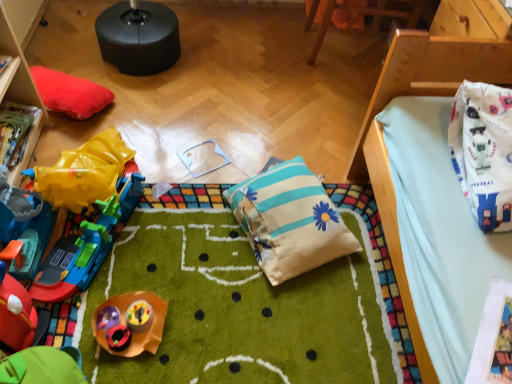
Question: Considering the relative sizes of white fabric bag at upper right and plastic toy at center, arranged as the first toy when ordered from the bottom, in the image provided, is white fabric bag at upper right bigger than plastic toy at center, arranged as the first toy when ordered from the bottom,?

Choices:
 (A) yes
 (B) no

Answer: (A)

Question: Considering the relative sizes of white fabric bag at upper right and plastic toy at center, marked as the 3th toy in a top-to-bottom arrangement, in the image provided, is white fabric bag at upper right shorter than plastic toy at center, marked as the 3th toy in a top-to-bottom arrangement,?

Choices:
 (A) yes
 (B) no

Answer: (B)

Question: Is plastic toy at center, marked as the 3th toy in a top-to-bottom arrangement, inside white fabric bag at upper right?

Choices:
 (A) no
 (B) yes

Answer: (A)

Question: Would you consider white fabric bag at upper right to be distant from plastic toy at center, arranged as the first toy when ordered from the bottom?

Choices:
 (A) no
 (B) yes

Answer: (B)

Question: From a real-world perspective, does white fabric bag at upper right sit lower than plastic toy at center, arranged as the first toy when ordered from the bottom?

Choices:
 (A) no
 (B) yes

Answer: (A)

Question: Is white fabric bag at upper right looking in the opposite direction of plastic toy at center, arranged as the first toy when ordered from the bottom?

Choices:
 (A) yes
 (B) no

Answer: (B)

Question: Is wooden toy train at left, which appears as the 1th furniture when viewed from the left, wider than rubberized yellow toy train at left, which is the first toy from top to bottom?

Choices:
 (A) no
 (B) yes

Answer: (A)

Question: From a real-world perspective, does wooden toy train at left, which appears as the 1th furniture when viewed from the left, sit lower than rubberized yellow toy train at left, positioned as the 3th toy in bottom-to-top order?

Choices:
 (A) no
 (B) yes

Answer: (A)

Question: Does wooden toy train at left, marked as the 3th furniture in a right-to-left arrangement, have a smaller size compared to rubberized yellow toy train at left, positioned as the 3th toy in bottom-to-top order?

Choices:
 (A) yes
 (B) no

Answer: (A)

Question: Would you consider wooden toy train at left, which appears as the 1th furniture when viewed from the left, to be distant from rubberized yellow toy train at left, which is the first toy from top to bottom?

Choices:
 (A) no
 (B) yes

Answer: (A)

Question: Is wooden toy train at left, which appears as the 1th furniture when viewed from the left, at the left side of rubberized yellow toy train at left, positioned as the 3th toy in bottom-to-top order?

Choices:
 (A) no
 (B) yes

Answer: (B)

Question: Does wooden toy train at left, marked as the 3th furniture in a right-to-left arrangement, have a lesser height compared to rubberized yellow toy train at left, positioned as the 3th toy in bottom-to-top order?

Choices:
 (A) no
 (B) yes

Answer: (B)

Question: Does striped cotton pillow at center have a larger size compared to rubberized green toy car at lower left, which ranks as the 2th toy in bottom-to-top order?

Choices:
 (A) no
 (B) yes

Answer: (B)